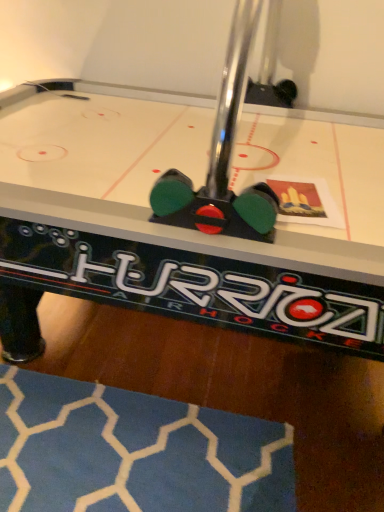
At what (x,y) coordinates should I click in order to perform the action: click on blue fabric rug at lower left. Please return your answer as a coordinate pair (x, y). The width and height of the screenshot is (384, 512). Looking at the image, I should click on (133, 452).

Describe the element at coordinates (133, 452) in the screenshot. I see `blue fabric rug at lower left` at that location.

Describe the element at coordinates (155, 227) in the screenshot. I see `white glossy air hockey table at center` at that location.

Find the location of a particular element. The image size is (384, 512). white glossy air hockey table at center is located at coordinates (155, 227).

Identify the location of blue fabric rug at lower left. (133, 452).

Which object is positioned more to the right, white glossy air hockey table at center or blue fabric rug at lower left?

white glossy air hockey table at center is more to the right.

Is white glossy air hockey table at center closer to the viewer compared to blue fabric rug at lower left?

That is True.

Is point (304, 279) behind point (151, 420)?

No, it is not.

From the image's perspective, is white glossy air hockey table at center above blue fabric rug at lower left?

Indeed, from the image's perspective, white glossy air hockey table at center is shown above blue fabric rug at lower left.

From a real-world perspective, who is located lower, white glossy air hockey table at center or blue fabric rug at lower left?

In real-world perspective, blue fabric rug at lower left is lower.

Which object is thinner, white glossy air hockey table at center or blue fabric rug at lower left?

blue fabric rug at lower left is thinner.

Is white glossy air hockey table at center taller or shorter than blue fabric rug at lower left?

Clearly, white glossy air hockey table at center is taller compared to blue fabric rug at lower left.

Considering the sizes of objects white glossy air hockey table at center and blue fabric rug at lower left in the image provided, who is bigger, white glossy air hockey table at center or blue fabric rug at lower left?

white glossy air hockey table at center.

Does white glossy air hockey table at center contain blue fabric rug at lower left?

Yes, blue fabric rug at lower left is a part of white glossy air hockey table at center.

Does white glossy air hockey table at center touch blue fabric rug at lower left?

white glossy air hockey table at center and blue fabric rug at lower left are clearly separated.

Is white glossy air hockey table at center oriented away from blue fabric rug at lower left?

No, white glossy air hockey table at center is not facing away from blue fabric rug at lower left.

What's the angular difference between white glossy air hockey table at center and blue fabric rug at lower left's facing directions?

88.4 degrees separate the facing orientations of white glossy air hockey table at center and blue fabric rug at lower left.

Where is `mat on the left of white glossy air hockey table at center`? The image size is (384, 512). mat on the left of white glossy air hockey table at center is located at coordinates (133, 452).

Visually, is blue fabric rug at lower left positioned to the left or to the right of white glossy air hockey table at center?

Clearly, blue fabric rug at lower left is on the left of white glossy air hockey table at center in the image.

Which object is more forward, blue fabric rug at lower left or white glossy air hockey table at center?

white glossy air hockey table at center is closer to the camera.

Between point (225, 417) and point (241, 158), which one is positioned behind?

The point (225, 417) is behind.

From the image's perspective, which one is positioned lower, blue fabric rug at lower left or white glossy air hockey table at center?

blue fabric rug at lower left is shown below in the image.

In the scene shown: From a real-world perspective, who is located higher, blue fabric rug at lower left or white glossy air hockey table at center?

From a 3D spatial view, white glossy air hockey table at center is above.

Which of these two, blue fabric rug at lower left or white glossy air hockey table at center, is thinner?

Thinner between the two is blue fabric rug at lower left.

Which of these two, blue fabric rug at lower left or white glossy air hockey table at center, stands shorter?

blue fabric rug at lower left is shorter.

Considering the sizes of objects blue fabric rug at lower left and white glossy air hockey table at center in the image provided, who is smaller, blue fabric rug at lower left or white glossy air hockey table at center?

Smaller between the two is blue fabric rug at lower left.

Is blue fabric rug at lower left inside the boundaries of white glossy air hockey table at center, or outside?

blue fabric rug at lower left is enclosed within white glossy air hockey table at center.

Is blue fabric rug at lower left in contact with white glossy air hockey table at center?

blue fabric rug at lower left is not next to white glossy air hockey table at center, and they're not touching.

Could you tell me if blue fabric rug at lower left is facing white glossy air hockey table at center?

Yes, blue fabric rug at lower left is facing white glossy air hockey table at center.

How different are the orientations of blue fabric rug at lower left and white glossy air hockey table at center in degrees?

The facing directions of blue fabric rug at lower left and white glossy air hockey table at center are 88.4 degrees apart.

Where is `table to the right of blue fabric rug at lower left`? This screenshot has width=384, height=512. table to the right of blue fabric rug at lower left is located at coordinates (155, 227).

Locate an element on the screen. This screenshot has height=512, width=384. mat located behind the white glossy air hockey table at center is located at coordinates (133, 452).

The height and width of the screenshot is (512, 384). In the image, there is a white glossy air hockey table at center. Identify the location of mat below it (from the image's perspective). (133, 452).